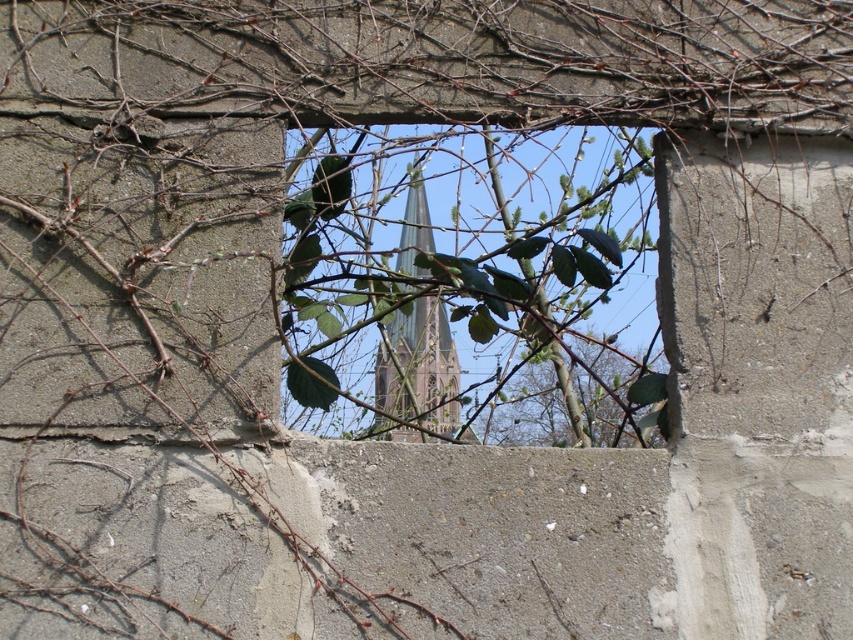
Does green leafy branch at center have a greater width compared to green glass tower at center?

Correct, the width of green leafy branch at center exceeds that of green glass tower at center.

Which of these two, green leafy branch at center or green glass tower at center, stands shorter?

With less height is green leafy branch at center.

Between point (519, 369) and point (454, 385), which one is positioned in front?

Point (454, 385) is more forward.

Where is `green leafy branch at center`? The width and height of the screenshot is (853, 640). green leafy branch at center is located at coordinates (607, 390).

Does green leafy branches at center have a smaller size compared to green leafy branch at center?

No, green leafy branches at center is not smaller than green leafy branch at center.

Is point (316, 156) closer to viewer compared to point (630, 404)?

Yes.

You are a GUI agent. You are given a task and a screenshot of the screen. Output one action in this format:
    pyautogui.click(x=<x>, y=<y>)
    Task: Click on the green leafy branches at center
    Image resolution: width=853 pixels, height=640 pixels.
    Given the screenshot: What is the action you would take?
    pyautogui.click(x=474, y=282)

Can you confirm if green leafy branches at center is positioned below green glass tower at center?

No.

Can you confirm if green leafy branches at center is bigger than green glass tower at center?

Correct, green leafy branches at center is larger in size than green glass tower at center.

Is point (312, 296) positioned after point (439, 404)?

No, (312, 296) is in front of (439, 404).

Locate an element on the screen. green leafy branches at center is located at coordinates (474, 282).